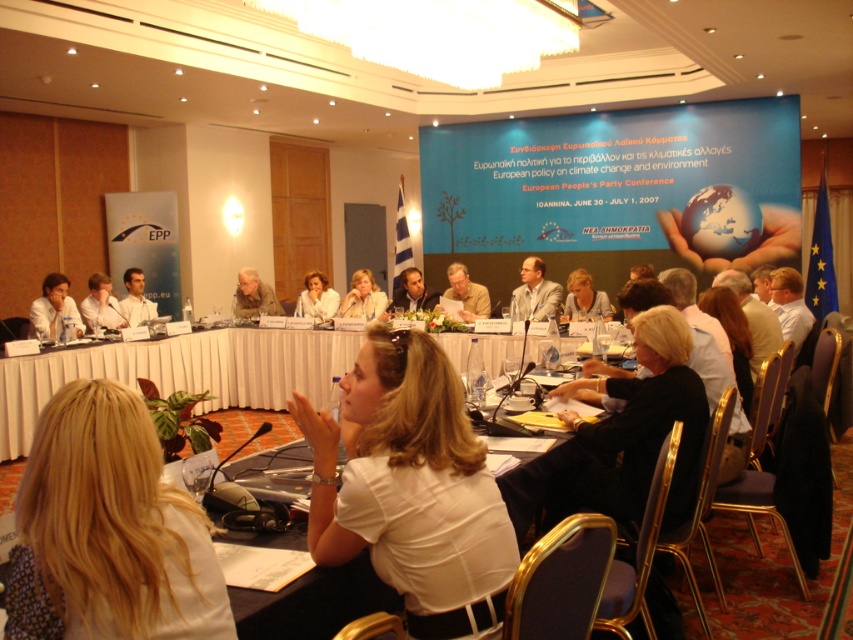
Does blonde hair at lower center come in front of light beige fabric jacket at center?

Yes.

Consider the image. Is blonde hair at lower center wider than light beige fabric jacket at center?

No.

The height and width of the screenshot is (640, 853). In order to click on blonde hair at lower center in this screenshot , I will do `click(732, 336)`.

Is white matte shirt at center to the left of light beige fabric jacket at center from the viewer's perspective?

Incorrect, white matte shirt at center is not on the left side of light beige fabric jacket at center.

Which is above, white matte shirt at center or light beige fabric jacket at center?

light beige fabric jacket at center is higher up.

Does point (476, 531) come behind point (352, 282)?

No, it is in front of (352, 282).

Locate an element on the screen. The image size is (853, 640). white matte shirt at center is located at coordinates (410, 486).

Does blonde hair at lower left come in front of light beige fabric jacket at center?

Yes, blonde hair at lower left is closer to the viewer.

Can you confirm if blonde hair at lower left is thinner than light beige fabric jacket at center?

Correct, blonde hair at lower left's width is less than light beige fabric jacket at center's.

This screenshot has height=640, width=853. In order to click on blonde hair at lower left in this screenshot , I will do `click(108, 529)`.